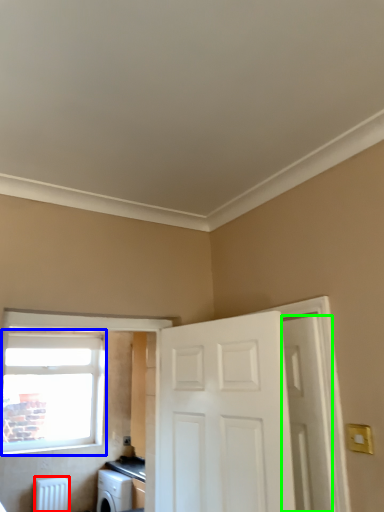
Question: Considering the real-world distances, which object is closest to radiator (highlighted by a red box)? window (highlighted by a blue box) or door (highlighted by a green box).

Choices:
 (A) window
 (B) door

Answer: (A)